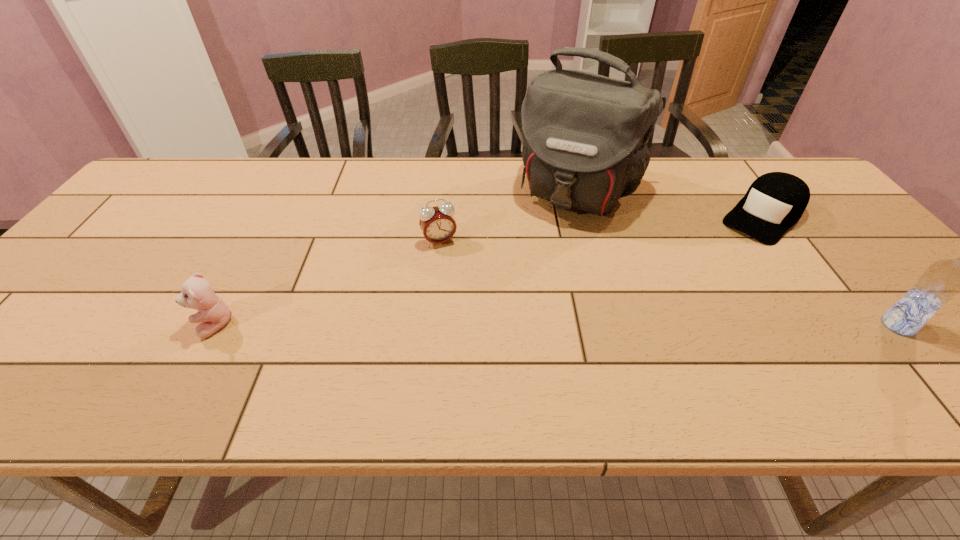
Identify the location of teddy bear. The width and height of the screenshot is (960, 540). (197, 293).

This screenshot has width=960, height=540. I want to click on the second tallest object, so click(x=942, y=280).

The width and height of the screenshot is (960, 540). Find the location of `cap`. cap is located at coordinates (775, 201).

Where is `the fourth object from right to left`? This screenshot has height=540, width=960. the fourth object from right to left is located at coordinates (437, 223).

The height and width of the screenshot is (540, 960). Find the location of `shoulder bag`. shoulder bag is located at coordinates (585, 135).

I want to click on the tallest object, so click(585, 135).

Find the location of a particular element. free space located 0.080m at the face of the leftmost object is located at coordinates (159, 326).

You are a GUI agent. You are given a task and a screenshot of the screen. Output one action in this format:
    pyautogui.click(x=<x>, y=<y>)
    Task: Click on the vacant space located 0.120m at the face of the leftmost object
    The height and width of the screenshot is (540, 960).
    Given the screenshot: What is the action you would take?
    pyautogui.click(x=140, y=326)

Where is `vacant area located 0.230m at the face of the leftmost object`? vacant area located 0.230m at the face of the leftmost object is located at coordinates (90, 326).

I want to click on free space located on the back of the vodka, so click(799, 209).